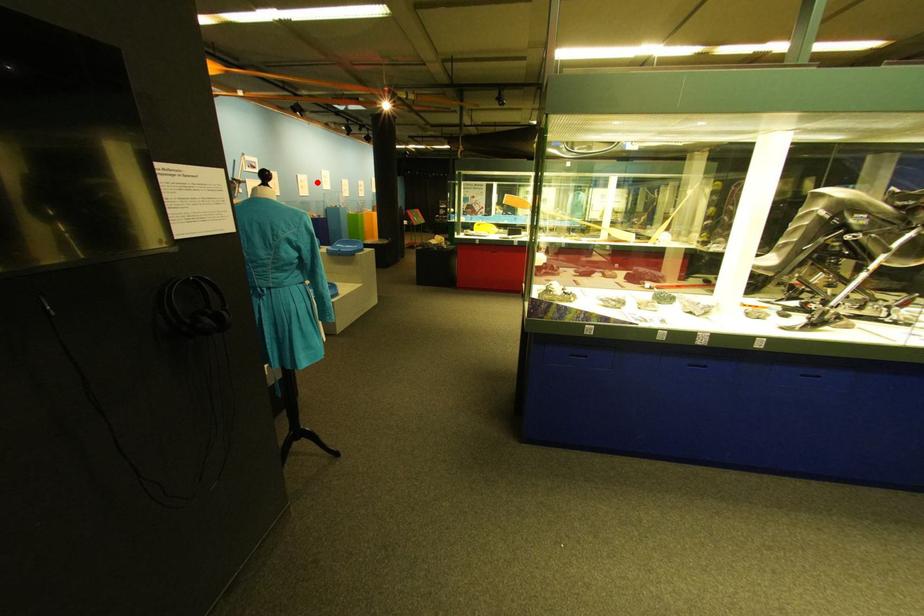
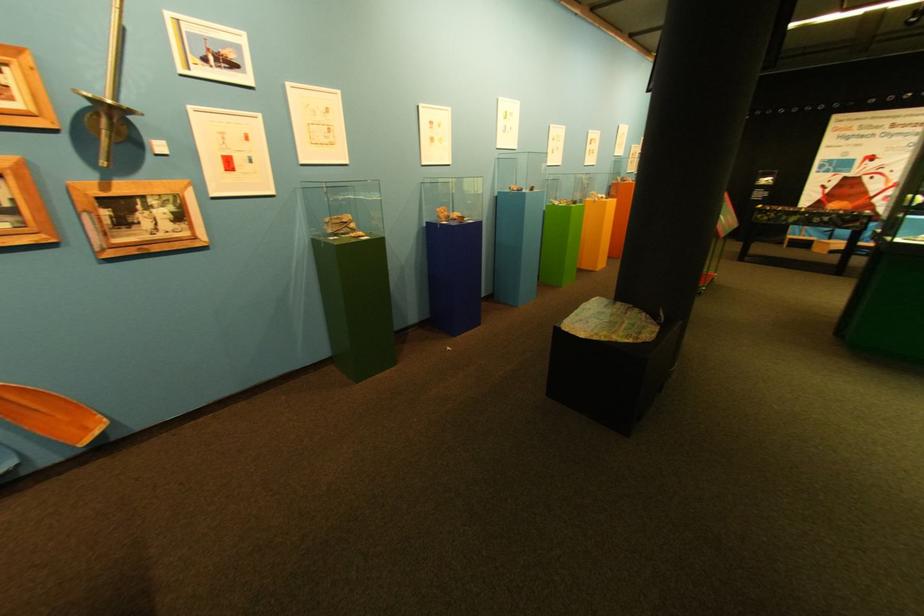
Question: I am providing you with two images of the same scene from different viewpoints. Given a red point in image1, look at the same physical point in image2. Is it:

Choices:
 (A) Closer to the viewpoint
 (B) Farther from the viewpoint

Answer: (B)